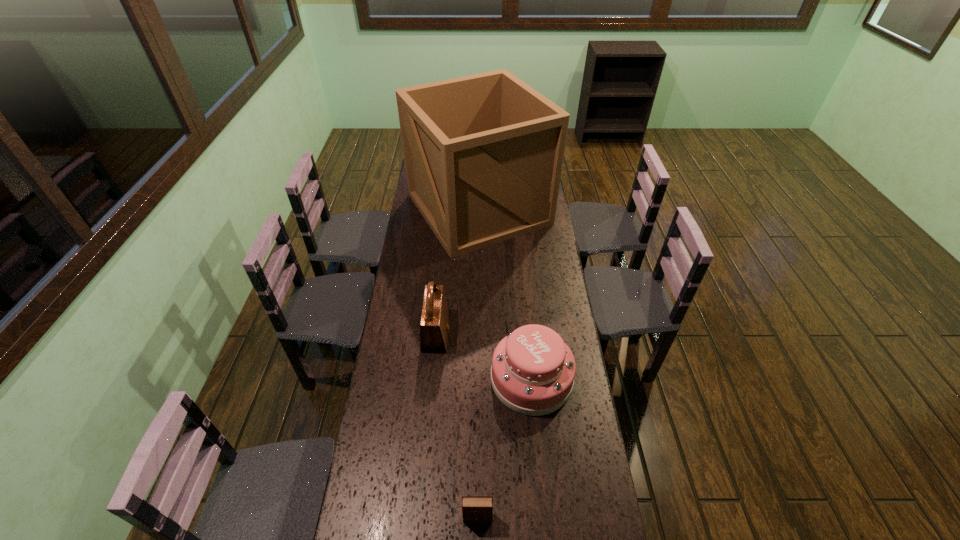
Where is `box at the left edge`? box at the left edge is located at coordinates (483, 153).

Where is `shoulder bag at the left edge`? This screenshot has width=960, height=540. shoulder bag at the left edge is located at coordinates [x=434, y=325].

Locate an element on the screen. This screenshot has height=540, width=960. box situated at the right edge is located at coordinates (483, 153).

The width and height of the screenshot is (960, 540). What are the coordinates of `cake that is at the right edge` in the screenshot? It's located at (532, 373).

At what (x,y) coordinates should I click in order to perform the action: click on object present at the far left corner. Please return your answer as a coordinate pair (x, y). The height and width of the screenshot is (540, 960). Looking at the image, I should click on (483, 153).

Find the location of a particular element. This screenshot has height=540, width=960. object that is at the far right corner is located at coordinates (483, 153).

Identify the location of free space at the left edge of the desktop. (396, 288).

Where is `free region at the right edge`? This screenshot has width=960, height=540. free region at the right edge is located at coordinates (596, 522).

In order to click on free area in between the diary and the shoulder bag in this screenshot , I will do `click(457, 426)`.

Where is `blank region between the diary and the cake`? The height and width of the screenshot is (540, 960). blank region between the diary and the cake is located at coordinates (504, 448).